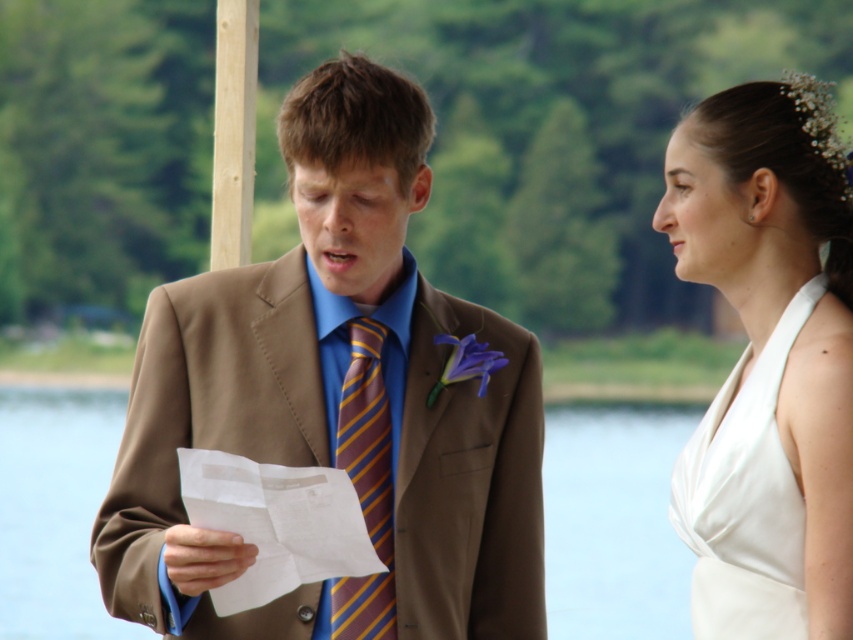
Question: Is white satin dress at upper right smaller than striped silk tie at center?

Choices:
 (A) no
 (B) yes

Answer: (A)

Question: Estimate the real-world distances between objects in this image. Which object is closer to the white paper at center?

Choices:
 (A) striped silk tie at center
 (B) brown textured suit at center

Answer: (B)

Question: Does white paper at center lie behind striped silk tie at center?

Choices:
 (A) no
 (B) yes

Answer: (B)

Question: Which object is the closest to the brown textured suit at center?

Choices:
 (A) striped silk tie at center
 (B) white satin dress at upper right
 (C) white paper at center

Answer: (A)

Question: Which object is positioned farthest from the striped silk tie at center?

Choices:
 (A) white satin dress at upper right
 (B) brown textured suit at center
 (C) white paper at center

Answer: (C)

Question: Does brown textured suit at center have a lesser width compared to white paper at center?

Choices:
 (A) yes
 (B) no

Answer: (B)